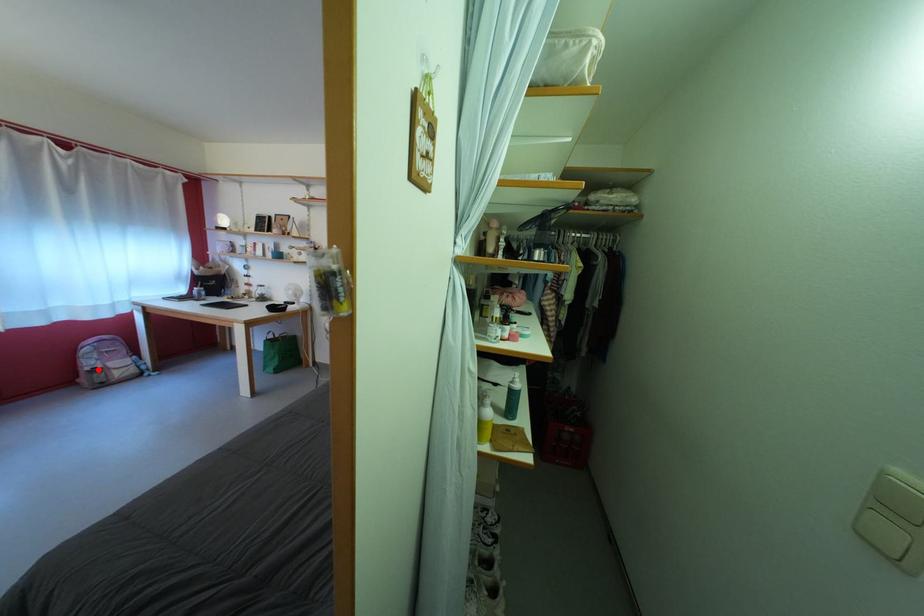
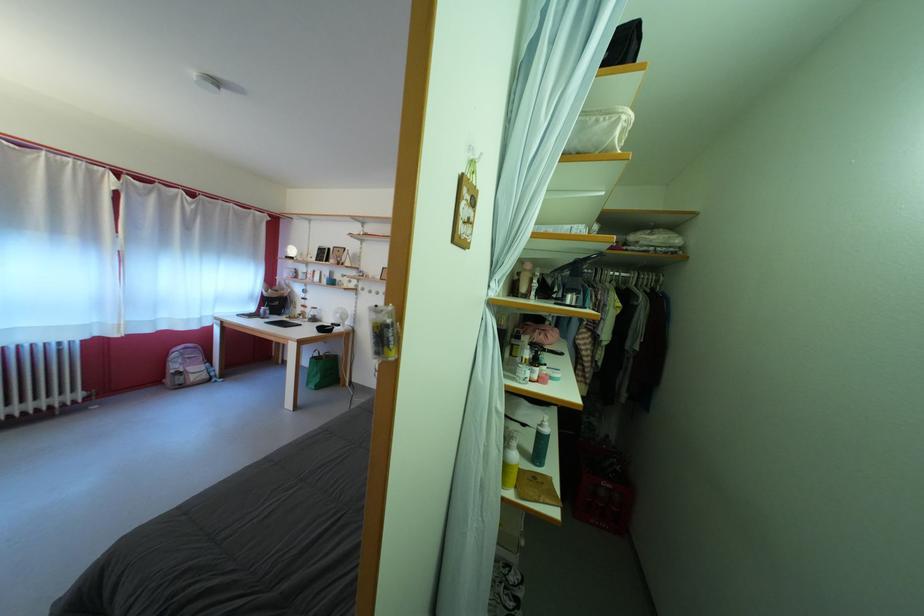
Question: I am providing you with two images of the same scene from different viewpoints. In image1, a red point is highlighted. Considering the same 3D point in image2, which of the following is correct?

Choices:
 (A) It is closer
 (B) It is farther

Answer: (A)